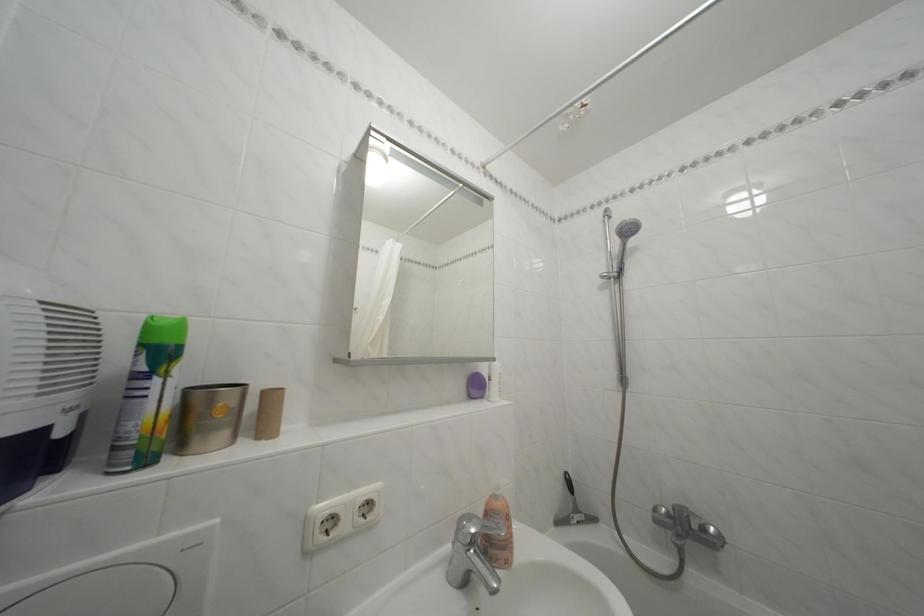
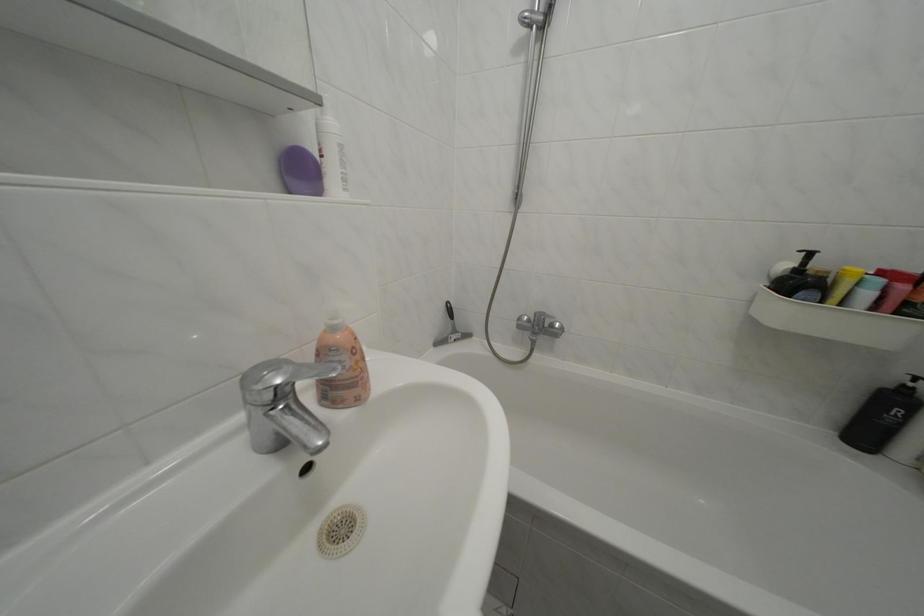
In the second image, find the point that corresponds to the point at 713,536 in the first image.

(562, 331)